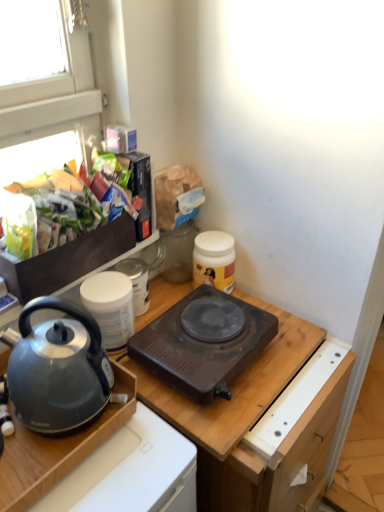
This screenshot has width=384, height=512. What are the coordinates of `vacant area on top of dark brown plastic hot plate at center, arranged as the second kitchen appliance when viewed from the left (from a real-world perspective)` in the screenshot? It's located at (207, 325).